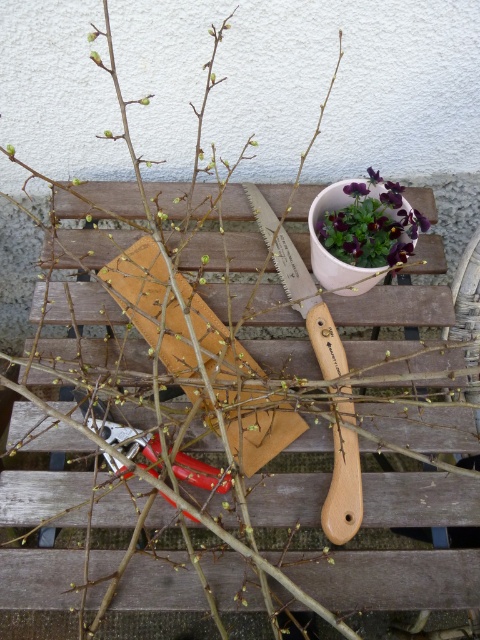
You are a gardener trying to place a new tool on the bench. The purple matte flower pot at upper center and the metallic red pliers at center are already there. Which object has a smaller width so you can place your tool next to it?

The purple matte flower pot at upper center is thinner than the metallic red pliers at center, so you can place your tool next to the purple matte flower pot at upper center as it has a smaller width.

You are standing in the garden and want to place a new tool on the wooden bench. The bench is divided into a grid with coordinates from 0 to 1 in both x and y directions. Where exactly should you place the new tool to align it with the existing wooden palette at center?

You should place the new tool at the coordinates point [300,288] to align it with the wooden palette at center.

You are standing in the garden and want to place a new flower pot on the wooden bench. The existing purple matte flower pot at upper center is in the way. Where should you move it to make space?

The purple matte flower pot at upper center is located at point (363, 225). To make space, move it to a different position on the bench away from the upper center area.